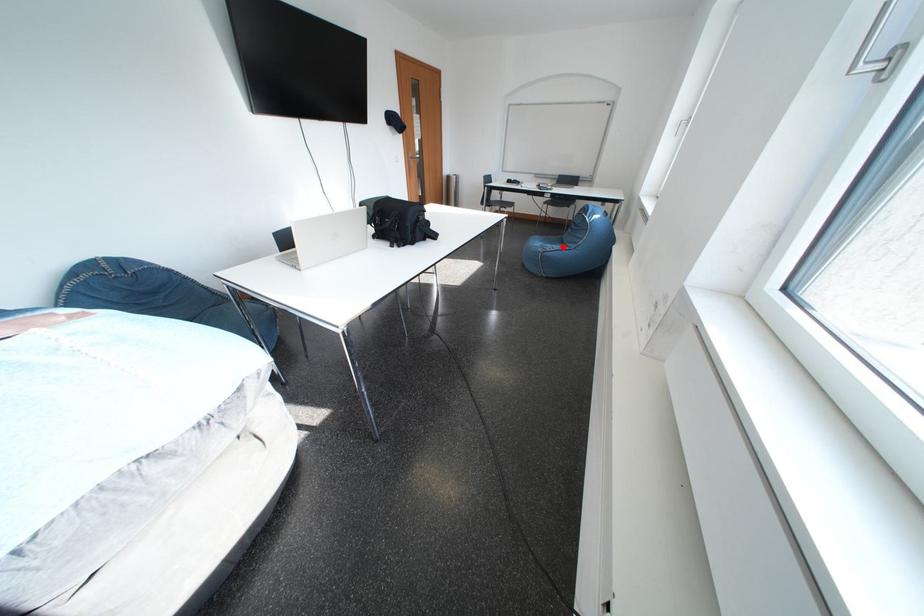
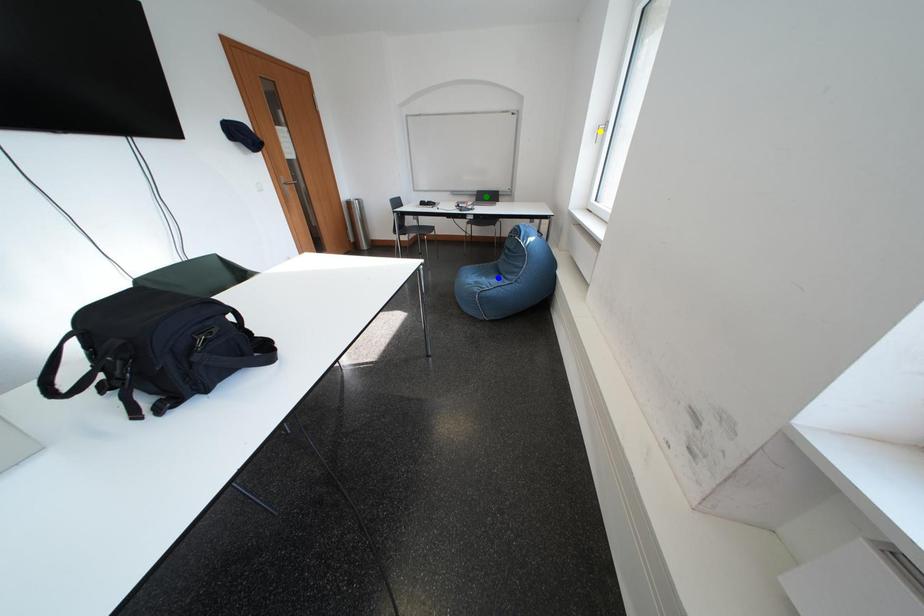
Question: I am providing you with two images of the same scene from different viewpoints. A red point is marked on the first image. You are given multiple points on the second image. Which spot in image 2 lines up with the point in image 1?

Choices:
 (A) blue point
 (B) yellow point
 (C) green point

Answer: (A)